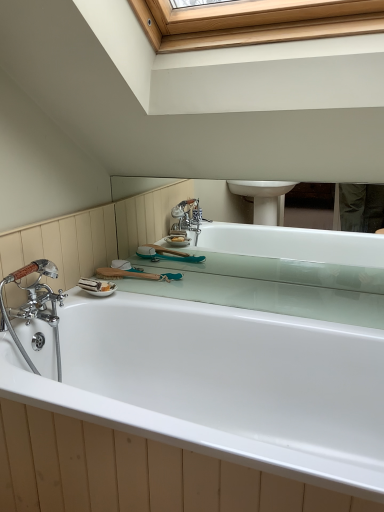
Question: Is wooden handled brush at upper center inside the boundaries of white glossy bathtub at center, or outside?

Choices:
 (A) outside
 (B) inside

Answer: (A)

Question: From the image's perspective, is wooden handled brush at upper center positioned above or below white glossy bathtub at center?

Choices:
 (A) above
 (B) below

Answer: (A)

Question: Is wooden handled brush at upper center to the left or to the right of white glossy bathtub at center in the image?

Choices:
 (A) right
 (B) left

Answer: (B)

Question: From a real-world perspective, is white glossy bathtub at center above or below wooden handled brush at upper center?

Choices:
 (A) above
 (B) below

Answer: (B)

Question: Looking at their shapes, would you say white glossy bathtub at center is wider or thinner than wooden handled brush at upper center?

Choices:
 (A) wide
 (B) thin

Answer: (A)

Question: From the image's perspective, relative to wooden handled brush at upper center, is white glossy bathtub at center above or below?

Choices:
 (A) below
 (B) above

Answer: (A)

Question: Do you think white glossy bathtub at center is within wooden handled brush at upper center, or outside of it?

Choices:
 (A) outside
 (B) inside

Answer: (A)